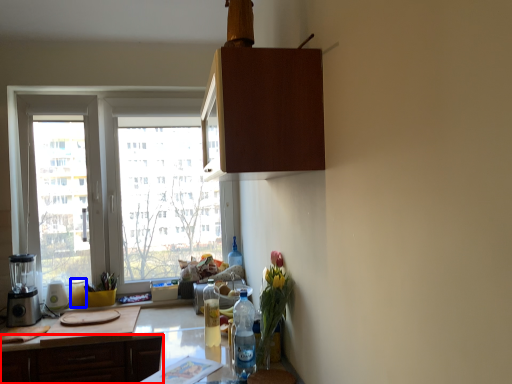
Question: Among these objects, which one is nearest to the camera, cabinetry (highlighted by a red box) or bottle (highlighted by a blue box)?

Choices:
 (A) cabinetry
 (B) bottle

Answer: (A)